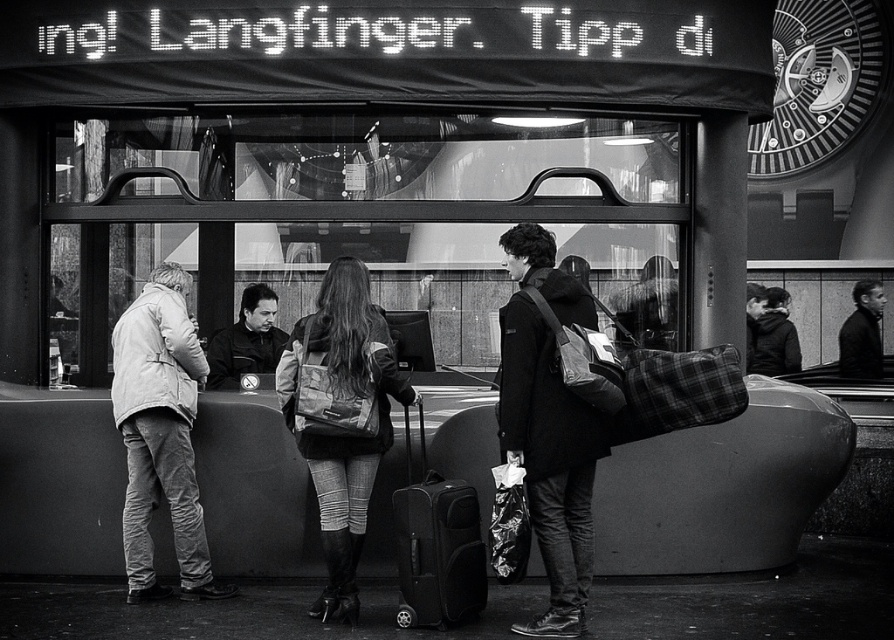
Question: Does light beige jacket at left appear on the left side of smooth black jacket at center?

Choices:
 (A) no
 (B) yes

Answer: (B)

Question: Is smooth black jacket at center positioned behind dark fabric jacket at center?

Choices:
 (A) yes
 (B) no

Answer: (A)

Question: Among these points, which one is farthest from the camera?

Choices:
 (A) (846, 372)
 (B) (125, 360)
 (C) (260, 340)
 (D) (519, 314)

Answer: (A)

Question: Which of these objects is positioned closest to the matte black suitcase at center?

Choices:
 (A) dark fabric jacket at center
 (B) matte black jacket at center
 (C) matte black backpack at center
 (D) smooth black jacket at center

Answer: (C)

Question: Which point is closer to the camera?

Choices:
 (A) (385, 422)
 (B) (562, 467)
 (C) (247, 317)

Answer: (B)

Question: Can you confirm if leather jacket at center is thinner than dark fabric jacket at center?

Choices:
 (A) yes
 (B) no

Answer: (A)